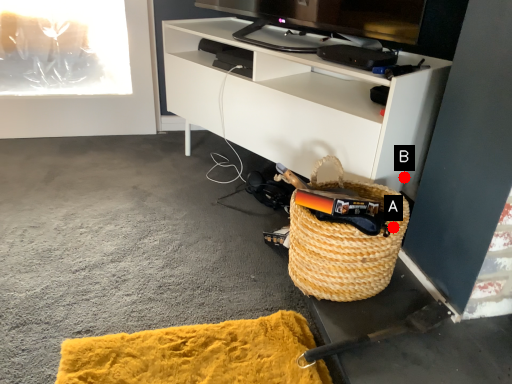
Question: Two points are circled on the image, labeled by A and B beside each circle. Which point is closer to the camera?

Choices:
 (A) A is closer
 (B) B is closer

Answer: (A)